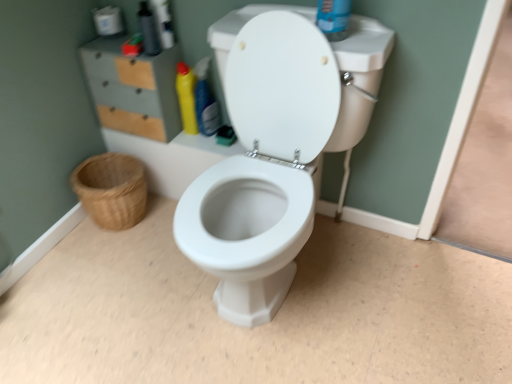
Question: Can you confirm if yellow glossy bottle at center, positioned as the 1th cleaning product in right-to-left order, is wider than matte gray/file cabinet at upper left?

Choices:
 (A) no
 (B) yes

Answer: (A)

Question: Could you tell me if yellow glossy bottle at center, positioned as the 1th cleaning product in right-to-left order, is facing matte gray/file cabinet at upper left?

Choices:
 (A) no
 (B) yes

Answer: (A)

Question: Is yellow glossy bottle at center, positioned as the 1th cleaning product in right-to-left order, smaller than matte gray/file cabinet at upper left?

Choices:
 (A) yes
 (B) no

Answer: (A)

Question: Is matte gray/file cabinet at upper left at the back of yellow glossy bottle at center, which is the 2th cleaning product in left-to-right order?

Choices:
 (A) no
 (B) yes

Answer: (A)

Question: From a real-world perspective, is yellow glossy bottle at center, positioned as the 1th cleaning product in right-to-left order, beneath matte gray/file cabinet at upper left?

Choices:
 (A) yes
 (B) no

Answer: (A)

Question: In terms of width, does translucent plastic bottle at upper left look wider or thinner when compared to woven natural basket at lower left?

Choices:
 (A) thin
 (B) wide

Answer: (A)

Question: Based on their sizes in the image, would you say translucent plastic bottle at upper left is bigger or smaller than woven natural basket at lower left?

Choices:
 (A) big
 (B) small

Answer: (B)

Question: Is point (148, 28) closer or farther from the camera than point (88, 175)?

Choices:
 (A) closer
 (B) farther

Answer: (A)

Question: From a real-world perspective, relative to woven natural basket at lower left, is translucent plastic bottle at upper left vertically above or below?

Choices:
 (A) below
 (B) above

Answer: (B)

Question: In terms of width, does matte gray/file cabinet at upper left look wider or thinner when compared to woven natural basket at lower left?

Choices:
 (A) thin
 (B) wide

Answer: (A)

Question: Based on their sizes in the image, would you say matte gray/file cabinet at upper left is bigger or smaller than woven natural basket at lower left?

Choices:
 (A) big
 (B) small

Answer: (A)

Question: From the image's perspective, is matte gray/file cabinet at upper left positioned above or below woven natural basket at lower left?

Choices:
 (A) below
 (B) above

Answer: (B)

Question: Is matte gray/file cabinet at upper left in front of or behind woven natural basket at lower left in the image?

Choices:
 (A) behind
 (B) front

Answer: (B)

Question: Which is correct: matte gray/file cabinet at upper left is inside white matte toilet paper at upper left, or outside of it?

Choices:
 (A) inside
 (B) outside

Answer: (B)

Question: Looking at the image, does matte gray/file cabinet at upper left seem bigger or smaller compared to white matte toilet paper at upper left?

Choices:
 (A) big
 (B) small

Answer: (A)